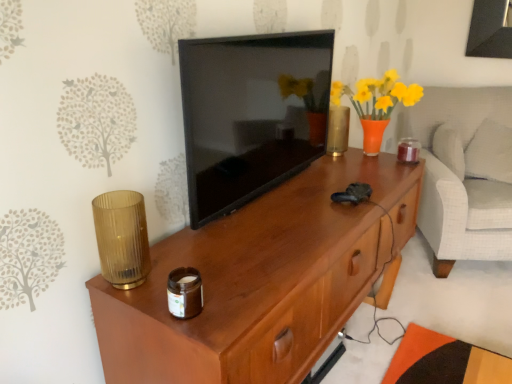
Locate an element on the screen. Image resolution: width=512 pixels, height=384 pixels. free space in front of amber ribbed glass at left, which ranks as the first candle holder in left-to-right order is located at coordinates (142, 306).